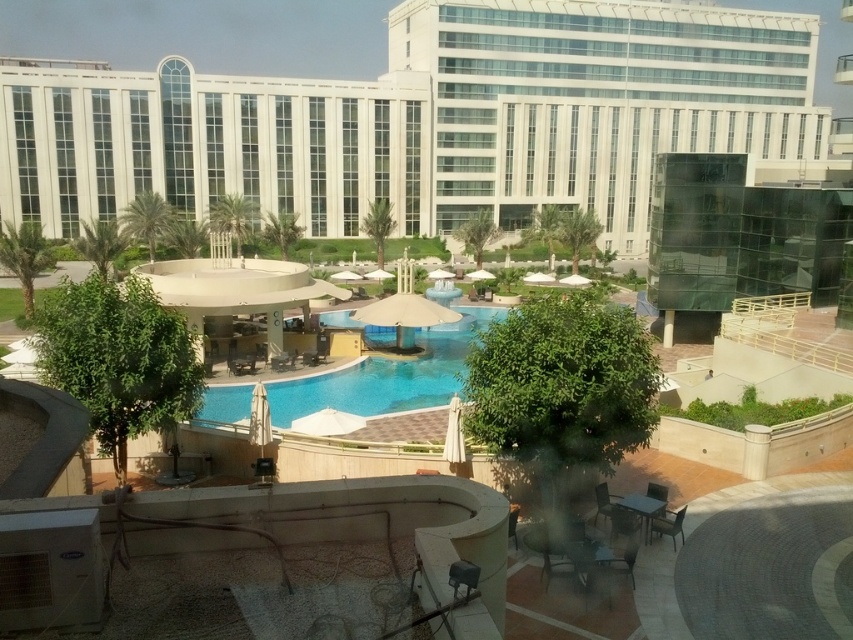
You are standing on the rooftop and want to place a new potted plant between the blue glossy swimming pool at center and the metallic silver chair at lower right. Based on their positions, which object should the plant be closer to?

The blue glossy swimming pool at center is closer to the viewer than the metallic silver chair at lower right, so the plant should be placed closer to the metallic silver chair at lower right to maintain equal distance between both objects.

You are standing on the rooftop and looking around. There is a point marked at coordinates (386, 376). Based on the scene description, where is this point located?

The point at coordinates (386, 376) is located on the blue glossy swimming pool at center.